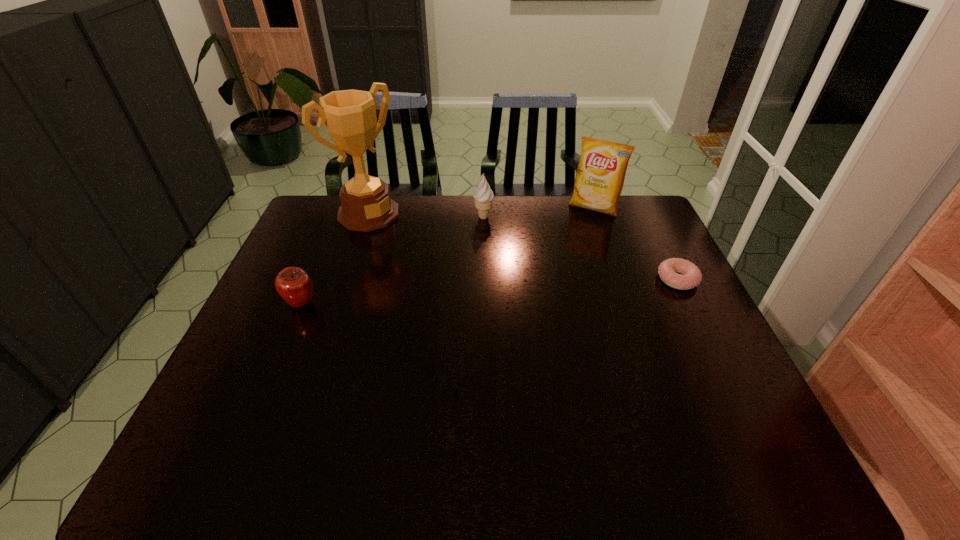
You are a GUI agent. You are given a task and a screenshot of the screen. Output one action in this format:
    pyautogui.click(x=<x>, y=<y>)
    Task: Click on the vacant area at the left edge of the desktop
    The image size is (960, 540).
    Given the screenshot: What is the action you would take?
    pyautogui.click(x=298, y=244)

Find the location of a particular element. This screenshot has width=960, height=540. free space at the right edge of the desktop is located at coordinates (x=663, y=237).

What are the coordinates of `vacant space at the near left corner of the desktop` in the screenshot? It's located at (235, 396).

Where is `vacant region at the far right corner of the desktop`? This screenshot has width=960, height=540. vacant region at the far right corner of the desktop is located at coordinates (622, 219).

Image resolution: width=960 pixels, height=540 pixels. Identify the location of free region at the near right corner of the desktop. (715, 420).

This screenshot has height=540, width=960. I want to click on vacant space that is in between the third tallest object and the tallest object, so click(x=426, y=215).

What are the coordinates of `empty space between the second object from right to left and the third object from right to left` in the screenshot? It's located at (539, 213).

You are a GUI agent. You are given a task and a screenshot of the screen. Output one action in this format:
    pyautogui.click(x=<x>, y=<y>)
    Task: Click on the empty location between the award and the second shortest object
    
    Given the screenshot: What is the action you would take?
    pyautogui.click(x=335, y=259)

The height and width of the screenshot is (540, 960). I want to click on vacant space in between the rightmost object and the award, so click(x=523, y=246).

Image resolution: width=960 pixels, height=540 pixels. Find the location of `free space that is in between the apple and the shortest object`. free space that is in between the apple and the shortest object is located at coordinates (490, 291).